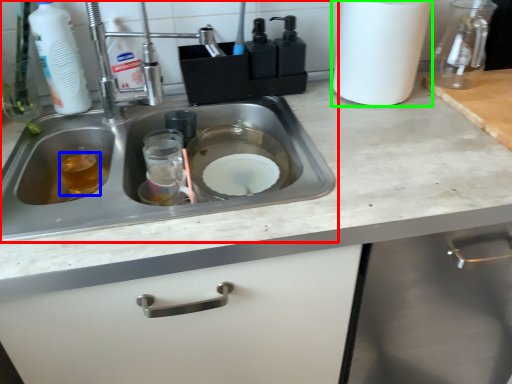
Question: Considering the real-world distances, which object is closest to sink (highlighted by a red box)? liquid (highlighted by a blue box) or paper towel (highlighted by a green box).

Choices:
 (A) liquid
 (B) paper towel

Answer: (A)